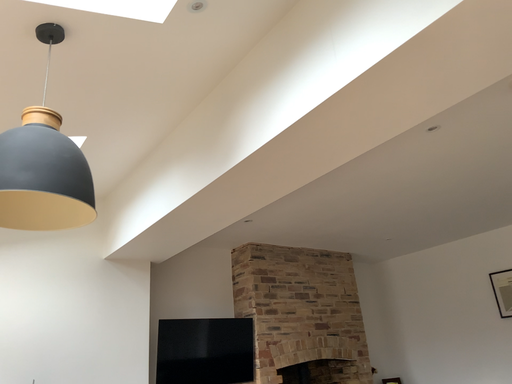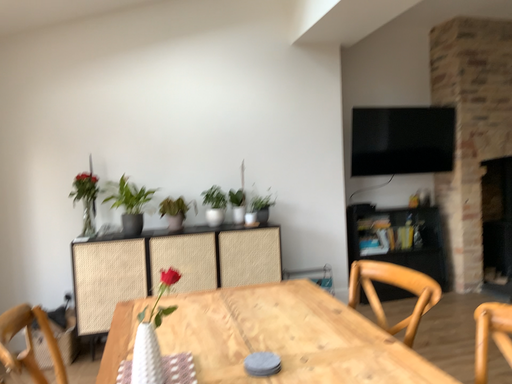
Question: Which way did the camera rotate in the video?

Choices:
 (A) rotated upward
 (B) rotated downward

Answer: (B)